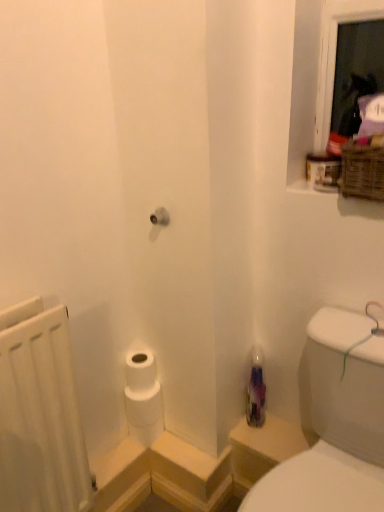
Locate an element on the screen. Image resolution: width=384 pixels, height=512 pixels. vacant area that lies to the right of translucent purple bottle at lower right is located at coordinates (279, 426).